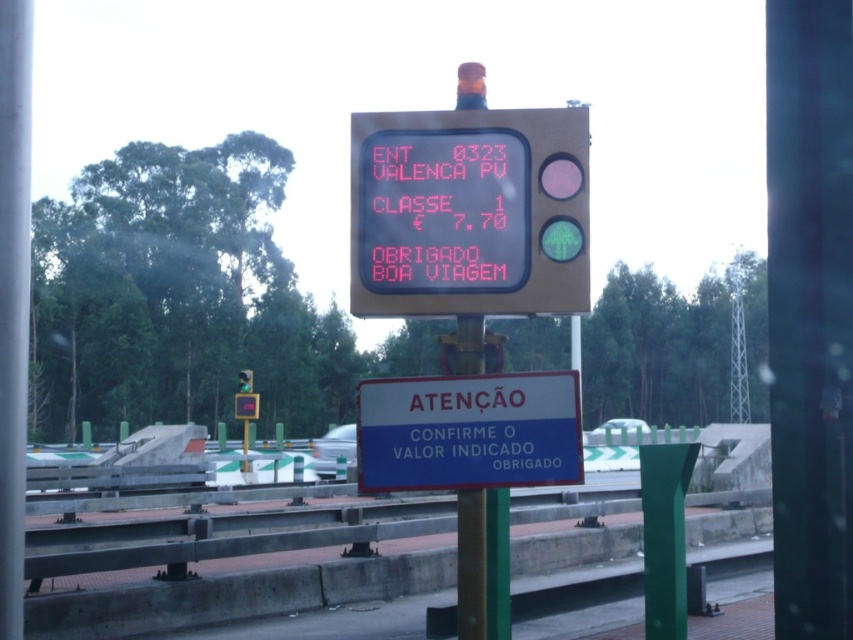
A car is passing through a toll booth and the digital display shows its entry details. The car is at point (543, 448). The toll booth operator needs to know if the car is within a 5 meter safety zone. Can you confirm if the car is within the safety zone?

The car at point (543, 448) is 4.44 meters away from the toll booth. Since 4.44 meters is less than 5 meters, the car is within the 5 meter safety zone.

You are driving a car and see the blue plastic sign at center and the green glass traffic light at upper center ahead. Which object is wider from your perspective?

The blue plastic sign at center is narrower than the green glass traffic light at upper center, so the green glass traffic light at upper center is wider from your perspective.